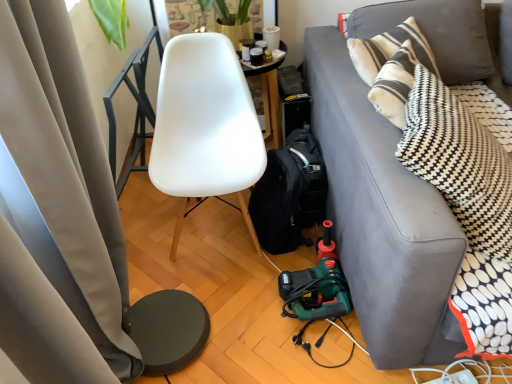
What are the coordinates of `vacant area that is in front of white matte chair at center` in the screenshot? It's located at (230, 294).